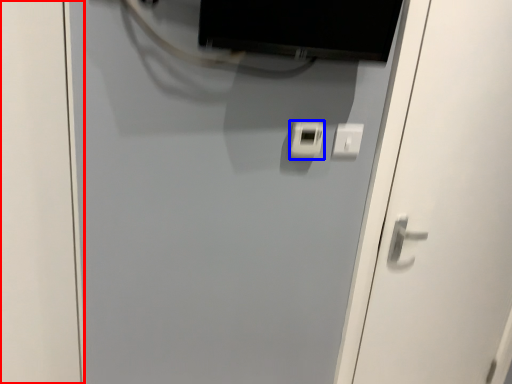
Question: Among these objects, which one is farthest to the camera, door (highlighted by a red box) or light switch (highlighted by a blue box)?

Choices:
 (A) door
 (B) light switch

Answer: (B)